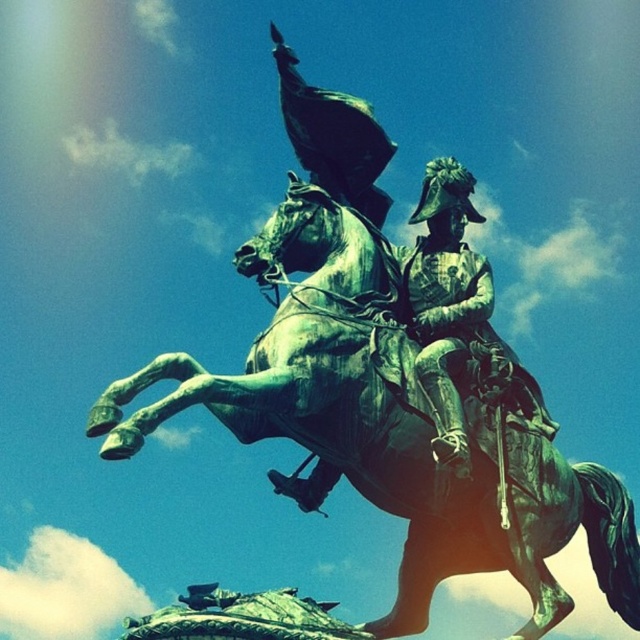
Image resolution: width=640 pixels, height=640 pixels. What do you see at coordinates (388, 426) in the screenshot?
I see `green patinated bronze horse at center` at bounding box center [388, 426].

Locate an element on the screen. Image resolution: width=640 pixels, height=640 pixels. green patinated bronze horse at center is located at coordinates (388, 426).